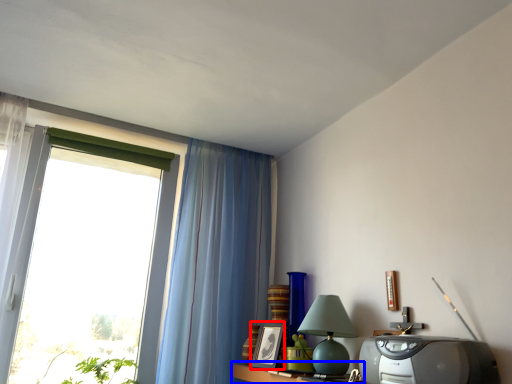
Question: Which object is closer to the camera taking this photo, picture frame (highlighted by a red box) or table (highlighted by a blue box)?

Choices:
 (A) picture frame
 (B) table

Answer: (B)